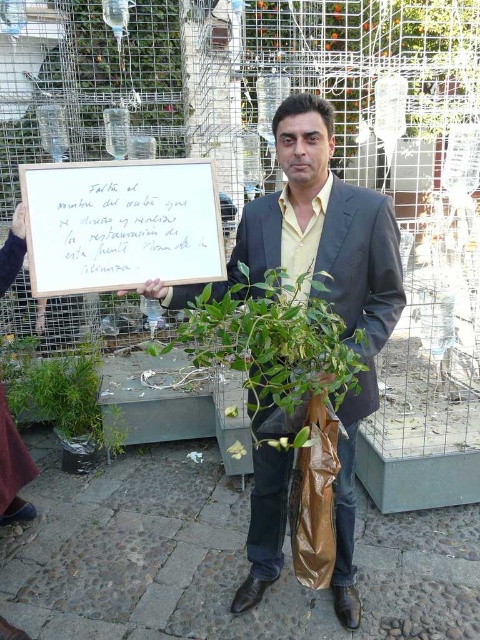
Is green leafy plant at center to the left of brown plastic bag at center from the viewer's perspective?

Indeed, green leafy plant at center is positioned on the left side of brown plastic bag at center.

Is green leafy plant at center wider than brown plastic bag at center?

Correct, the width of green leafy plant at center exceeds that of brown plastic bag at center.

Is point (312, 369) positioned in front of point (297, 568)?

That is True.

You are a GUI agent. You are given a task and a screenshot of the screen. Output one action in this format:
    pyautogui.click(x=<x>, y=<y>)
    Task: Click on the green leafy plant at center
    The height and width of the screenshot is (640, 480).
    Given the screenshot: What is the action you would take?
    pyautogui.click(x=269, y=374)

Is matte black suit at center thinner than white paper at center?

Incorrect, matte black suit at center's width is not less than white paper at center's.

Which is more to the right, matte black suit at center or white paper at center?

matte black suit at center

Between point (362, 300) and point (59, 266), which one is positioned behind?

Positioned behind is point (362, 300).

Find the location of a particular element. matte black suit at center is located at coordinates (327, 280).

Does matte black suit at center appear on the right side of brown plastic bag at center?

In fact, matte black suit at center is to the left of brown plastic bag at center.

How distant is matte black suit at center from brown plastic bag at center?

matte black suit at center is 26.79 centimeters from brown plastic bag at center.

Who is more forward, (x=295, y=106) or (x=323, y=536)?

Positioned in front is point (x=295, y=106).

Identify the location of matte black suit at center. (327, 280).